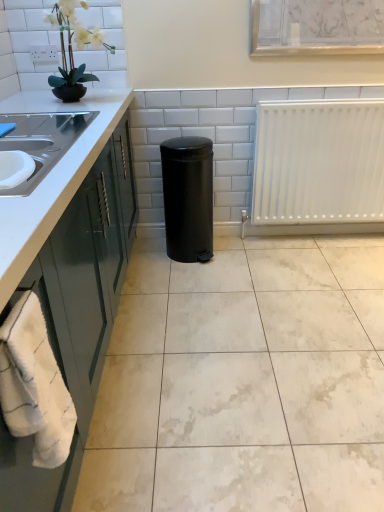
At what (x,y) coordinates should I click in order to perform the action: click on vacant space to the right of black matte trash can at center. Please return your answer as a coordinate pair (x, y). This screenshot has height=512, width=384. Looking at the image, I should click on (245, 255).